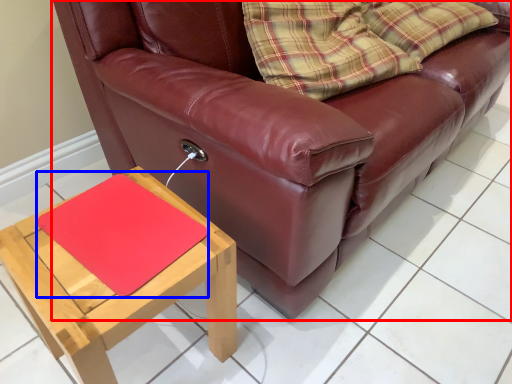
Question: Which object appears farthest to the camera in this image, studio couch (highlighted by a red box) or mat (highlighted by a blue box)?

Choices:
 (A) studio couch
 (B) mat

Answer: (B)